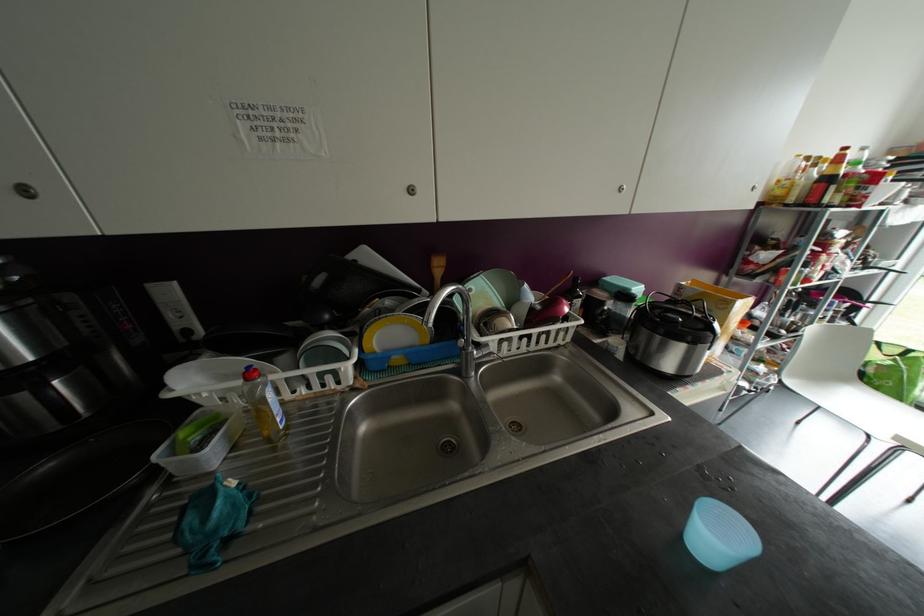
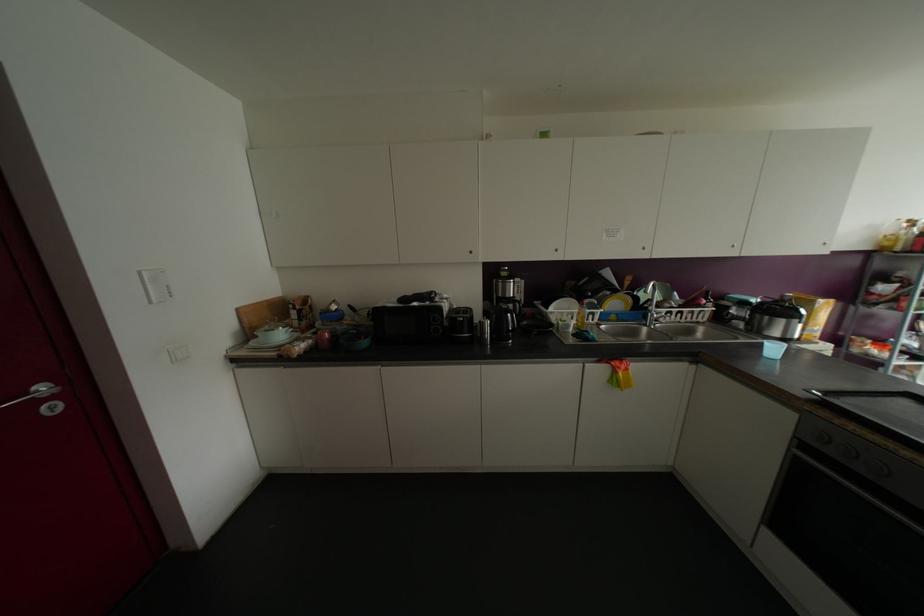
Where in the second image is the point corresponding to (27,191) from the first image?

(555, 249)